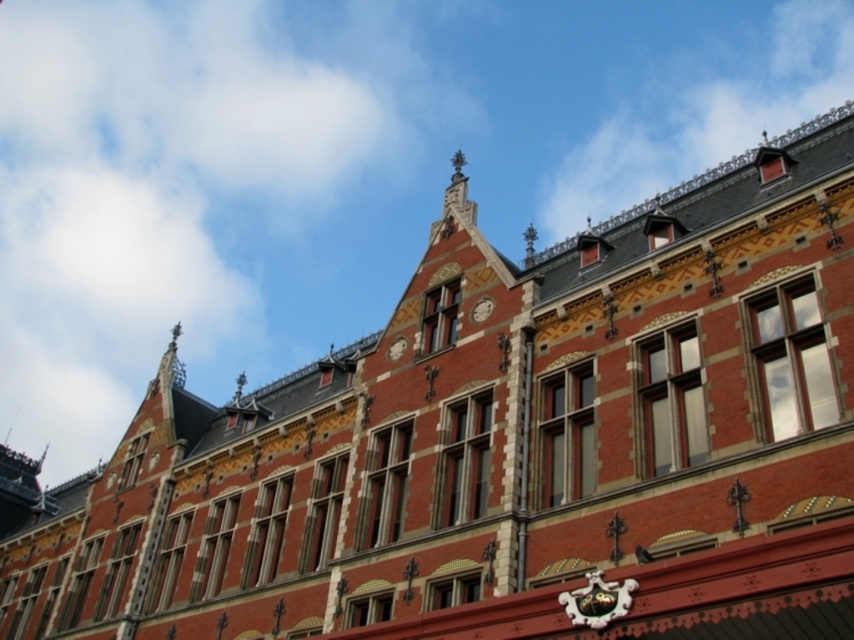
Question: Is matte red clock at center bigger than matte gray clock at center?

Choices:
 (A) no
 (B) yes

Answer: (B)

Question: Which of the following is the closest to the observer?

Choices:
 (A) matte gray clock at center
 (B) matte red clock at center

Answer: (B)

Question: Does matte red clock at center appear under matte gray clock at center?

Choices:
 (A) no
 (B) yes

Answer: (A)

Question: Can you confirm if matte red clock at center is positioned to the left of matte gray clock at center?

Choices:
 (A) no
 (B) yes

Answer: (A)